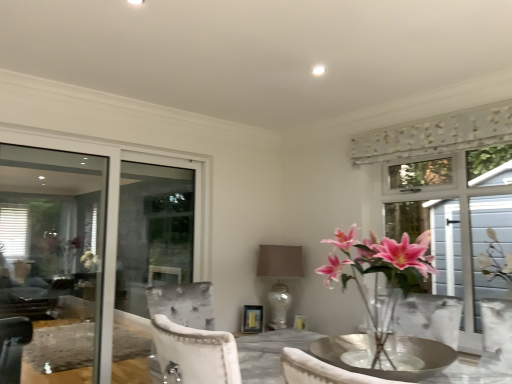
Describe the element at coordinates (380, 272) in the screenshot. I see `pink glass vase at center right` at that location.

Image resolution: width=512 pixels, height=384 pixels. Find the location of `clear glass window at left`. clear glass window at left is located at coordinates (88, 247).

What do you see at coordinates (435, 135) in the screenshot?
I see `floral fabric curtain at upper right` at bounding box center [435, 135].

You are a GUI agent. You are given a task and a screenshot of the screen. Output one action in this format:
    pyautogui.click(x=<x>, y=<y>)
    Task: Click on the white textured screen at right
    The image size is (512, 384).
    Given the screenshot: What is the action you would take?
    pyautogui.click(x=487, y=243)

This screenshot has width=512, height=384. I want to click on curtain behind the white textured screen at right, so pyautogui.click(x=435, y=135).

From the image's perspective, would you say floral fabric curtain at upper right is positioned over white textured screen at right?

Indeed, from the image's perspective, floral fabric curtain at upper right is shown above white textured screen at right.

How many degrees apart are the facing directions of floral fabric curtain at upper right and white textured screen at right?

The angle between the facing direction of floral fabric curtain at upper right and the facing direction of white textured screen at right is 0.282 degrees.

Is point (283, 258) farther from viewer compared to point (397, 268)?

Yes, it is.

Between satin beige lampshade at center and pink glass vase at center right, which one appears on the right side from the viewer's perspective?

pink glass vase at center right is more to the right.

Looking at this image, is satin beige lampshade at center bigger than pink glass vase at center right?

No.

Which of these two, satin beige lampshade at center or pink glass vase at center right, is wider?

With larger width is pink glass vase at center right.

From the image's perspective, relative to floral fabric curtain at upper right, is clear glass window at left above or below?

Based on their image positions, clear glass window at left is located beneath floral fabric curtain at upper right.

Consider the image. Is clear glass window at left taller than floral fabric curtain at upper right?

Yes, clear glass window at left is taller than floral fabric curtain at upper right.

How distant is clear glass window at left from floral fabric curtain at upper right?

clear glass window at left is 3.92 meters away from floral fabric curtain at upper right.

Is clear glass window at left bigger or smaller than floral fabric curtain at upper right?

In the image, clear glass window at left appears to be larger than floral fabric curtain at upper right.

Considering the sizes of objects white textured screen at right and floral fabric curtain at upper right in the image provided, who is wider, white textured screen at right or floral fabric curtain at upper right?

With larger width is white textured screen at right.

The image size is (512, 384). What are the coordinates of `curtain that appears behind the white textured screen at right` in the screenshot? It's located at (435, 135).

From the image's perspective, between white textured screen at right and floral fabric curtain at upper right, which one is located above?

From the image's view, floral fabric curtain at upper right is above.

Does white textured screen at right have a lesser height compared to satin beige lampshade at center?

No, white textured screen at right is not shorter than satin beige lampshade at center.

Is white textured screen at right located outside satin beige lampshade at center?

white textured screen at right lies outside satin beige lampshade at center's area.

From the image's perspective, which one is positioned lower, white textured screen at right or satin beige lampshade at center?

satin beige lampshade at center is shown below in the image.

Considering the sizes of objects floral fabric curtain at upper right and clear glass window at left in the image provided, who is wider, floral fabric curtain at upper right or clear glass window at left?

floral fabric curtain at upper right is wider.

Is floral fabric curtain at upper right inside the boundaries of clear glass window at left, or outside?

floral fabric curtain at upper right cannot be found inside clear glass window at left.

Is clear glass window at left at the back of floral fabric curtain at upper right?

No, floral fabric curtain at upper right is not facing the opposite direction of clear glass window at left.

Which point is more distant from viewer, (367,132) or (9,186)?

The point (9,186) is behind.

Which object is wider, satin beige lampshade at center or clear glass window at left?

Wider between the two is satin beige lampshade at center.

Considering the positions of objects satin beige lampshade at center and clear glass window at left in the image provided, who is in front, satin beige lampshade at center or clear glass window at left?

clear glass window at left.

From the image's perspective, does satin beige lampshade at center appear lower than clear glass window at left?

Correct, satin beige lampshade at center appears lower than clear glass window at left in the image.

Looking at this image, can you see satin beige lampshade at center touching clear glass window at left?

They are not placed beside each other.

Identify the location of curtain that is behind the white textured screen at right. The image size is (512, 384). (435, 135).

The image size is (512, 384). In the image, there is a satin beige lampshade at center. In order to click on floral arrangement above it (from the image's perspective) in this screenshot , I will do `click(380, 272)`.

Estimate the real-world distances between objects in this image. Which object is closer to clear glass window at left, floral fabric curtain at upper right or white textured screen at right?

floral fabric curtain at upper right.

Estimate the real-world distances between objects in this image. Which object is closer to white textured screen at right, pink glass vase at center right or floral fabric curtain at upper right?

Based on the image, floral fabric curtain at upper right appears to be nearer to white textured screen at right.

When comparing their distances from pink glass vase at center right, does white textured screen at right or floral fabric curtain at upper right seem further?

floral fabric curtain at upper right is positioned further to the anchor pink glass vase at center right.

Estimate the real-world distances between objects in this image. Which object is closer to clear glass window at left, pink glass vase at center right or satin beige lampshade at center?

Among the two, satin beige lampshade at center is located nearer to clear glass window at left.

Estimate the real-world distances between objects in this image. Which object is closer to satin beige lampshade at center, floral fabric curtain at upper right or clear glass window at left?

floral fabric curtain at upper right is closer to satin beige lampshade at center.

Estimate the real-world distances between objects in this image. Which object is closer to clear glass window at left, satin beige lampshade at center or pink glass vase at center right?

Among the two, satin beige lampshade at center is located nearer to clear glass window at left.

When comparing their distances from white textured screen at right, does satin beige lampshade at center or pink glass vase at center right seem closer?

pink glass vase at center right lies closer to white textured screen at right than the other object.

Estimate the real-world distances between objects in this image. Which object is further from pink glass vase at center right, satin beige lampshade at center or floral fabric curtain at upper right?

Among the two, floral fabric curtain at upper right is located further to pink glass vase at center right.

Where is `window screen positioned between pink glass vase at center right and satin beige lampshade at center from near to far`? window screen positioned between pink glass vase at center right and satin beige lampshade at center from near to far is located at coordinates (487, 243).

Identify the location of window between pink glass vase at center right and satin beige lampshade at center in the front-back direction. The height and width of the screenshot is (384, 512). (88, 247).

Where is `floral arrangement between clear glass window at left and white textured screen at right`? floral arrangement between clear glass window at left and white textured screen at right is located at coordinates (380, 272).

The height and width of the screenshot is (384, 512). I want to click on floral arrangement between clear glass window at left and floral fabric curtain at upper right, so click(380, 272).